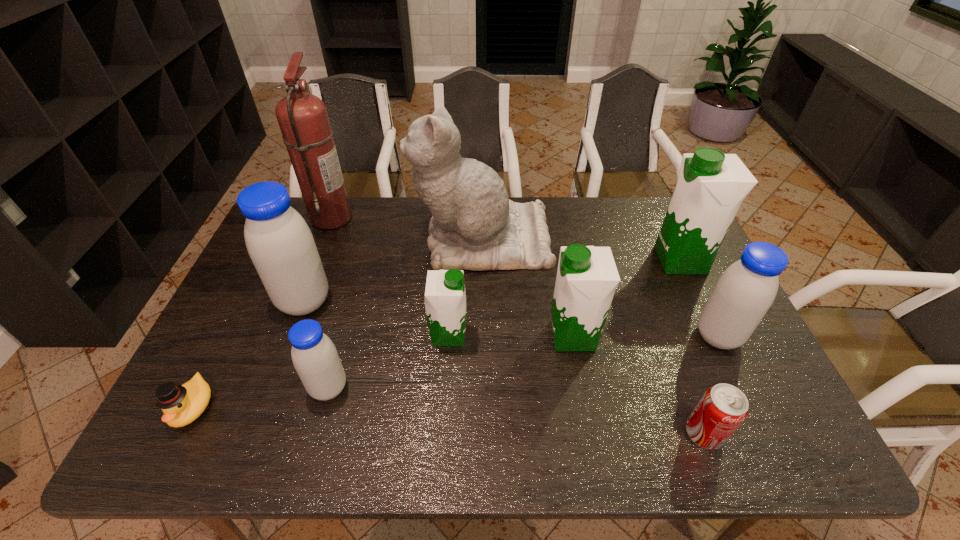
Identify the location of green soya milk that stands as the closest to the second biggest blue soya milk. The height and width of the screenshot is (540, 960). (711, 185).

Locate an element on the screen. blue soya milk object that ranks as the third closest to the second smallest green soya milk is located at coordinates (280, 244).

You are a GUI agent. You are given a task and a screenshot of the screen. Output one action in this format:
    pyautogui.click(x=<x>, y=<y>)
    Task: Click on the blue soya milk that is the second closest to the fire extinguisher
    The image size is (960, 540).
    Given the screenshot: What is the action you would take?
    pyautogui.click(x=314, y=356)

Where is `vacant space that satisfies the following two spatial constraints: 1. on the front-facing side of the second green soya milk from right to left; 2. on the left side of the third object from right to left`? vacant space that satisfies the following two spatial constraints: 1. on the front-facing side of the second green soya milk from right to left; 2. on the left side of the third object from right to left is located at coordinates (591, 433).

Where is `free point that satisfies the following two spatial constraints: 1. on the front-facing side of the fire extinguisher; 2. on the front-facing side of the duck`? free point that satisfies the following two spatial constraints: 1. on the front-facing side of the fire extinguisher; 2. on the front-facing side of the duck is located at coordinates (258, 407).